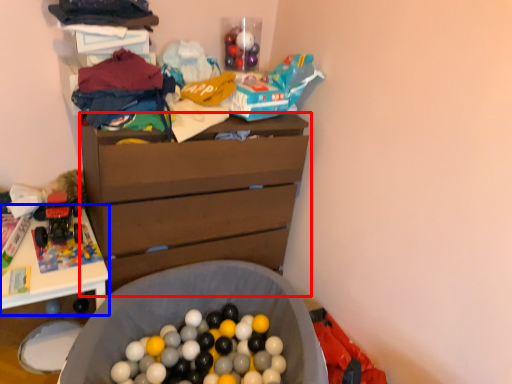
Question: Among these objects, which one is nearest to the camera, chest of drawers (highlighted by a red box) or table (highlighted by a blue box)?

Choices:
 (A) chest of drawers
 (B) table

Answer: (B)